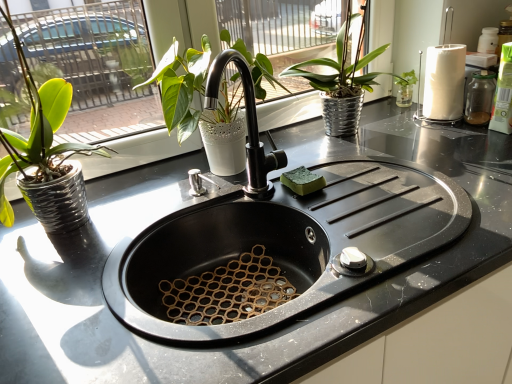
Question: From a real-world perspective, is green matte plant at left, placed as the 1th houseplant when sorted from left to right, above or below metallic silver pot at upper center, which is the first houseplant from right to left?

Choices:
 (A) below
 (B) above

Answer: (B)

Question: Is green matte plant at left, placed as the 1th houseplant when sorted from left to right, spatially inside metallic silver pot at upper center, which is the first houseplant from right to left, or outside of it?

Choices:
 (A) outside
 (B) inside

Answer: (A)

Question: Which is farther from the metallic silver pot at upper center, which is the first houseplant from right to left?

Choices:
 (A) matte white pot at upper center, the 2th houseplant when ordered from right to left
 (B) green matte plant at left, placed as the 1th houseplant when sorted from left to right
 (C) black matte sink at center

Answer: (B)

Question: Estimate the real-world distances between objects in this image. Which object is farther from the green matte plant at left, placed as the third houseplant when sorted from right to left?

Choices:
 (A) black matte sink at center
 (B) metallic silver pot at upper center, positioned as the 3th houseplant in left-to-right order
 (C) matte white pot at upper center, the 2th houseplant when ordered from right to left

Answer: (B)